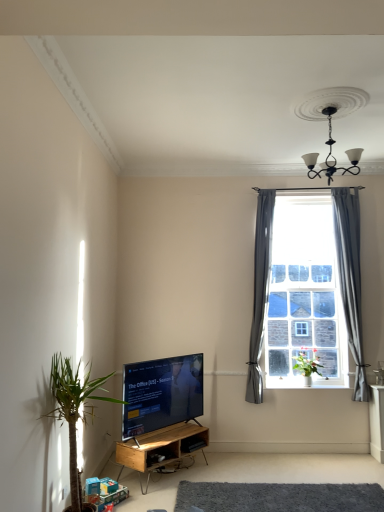
Question: Does woodenmaterial/textureshelf at lower center have a lesser width compared to gray fabric curtain at right, which ranks as the first curtain in left-to-right order?

Choices:
 (A) yes
 (B) no

Answer: (B)

Question: Is gray fabric curtain at right, which ranks as the 2th curtain in right-to-left order, located within woodenmaterial/textureshelf at lower center?

Choices:
 (A) yes
 (B) no

Answer: (B)

Question: Could you tell me if woodenmaterial/textureshelf at lower center is turned towards gray fabric curtain at right, which ranks as the 2th curtain in right-to-left order?

Choices:
 (A) yes
 (B) no

Answer: (B)

Question: Is woodenmaterial/textureshelf at lower center far away from gray fabric curtain at right, which ranks as the first curtain in left-to-right order?

Choices:
 (A) no
 (B) yes

Answer: (B)

Question: From the image's perspective, would you say woodenmaterial/textureshelf at lower center is positioned over gray fabric curtain at right, which ranks as the first curtain in left-to-right order?

Choices:
 (A) yes
 (B) no

Answer: (B)

Question: Is clear glass window at center taller or shorter than black glossy tv at lower center?

Choices:
 (A) tall
 (B) short

Answer: (A)

Question: Is clear glass window at center bigger or smaller than black glossy tv at lower center?

Choices:
 (A) big
 (B) small

Answer: (A)

Question: From a real-world perspective, relative to black glossy tv at lower center, is clear glass window at center vertically above or below?

Choices:
 (A) above
 (B) below

Answer: (A)

Question: Looking at their shapes, would you say clear glass window at center is wider or thinner than black glossy tv at lower center?

Choices:
 (A) wide
 (B) thin

Answer: (A)

Question: From the image's perspective, is green leafy plant at lower left, the 2th houseplant from the right, positioned above or below green glossy plant at window, acting as the second houseplant starting from the left?

Choices:
 (A) above
 (B) below

Answer: (A)

Question: Relative to green glossy plant at window, the 1th houseplant when ordered from back to front, is green leafy plant at lower left, the 2th houseplant from the right, in front or behind?

Choices:
 (A) front
 (B) behind

Answer: (A)

Question: Looking at the image, does green leafy plant at lower left, the first houseplant from the left, seem bigger or smaller compared to green glossy plant at window, arranged as the 2th houseplant when viewed from the front?

Choices:
 (A) big
 (B) small

Answer: (A)

Question: Is point (57, 415) closer or farther from the camera than point (317, 362)?

Choices:
 (A) farther
 (B) closer

Answer: (B)

Question: Is green glossy plant at window, acting as the second houseplant starting from the left, wider or thinner than gray fabric curtain at right, which ranks as the first curtain in left-to-right order?

Choices:
 (A) thin
 (B) wide

Answer: (B)

Question: From the image's perspective, is green glossy plant at window, the 1th houseplant when ordered from back to front, located above or below gray fabric curtain at right, which ranks as the first curtain in left-to-right order?

Choices:
 (A) below
 (B) above

Answer: (A)